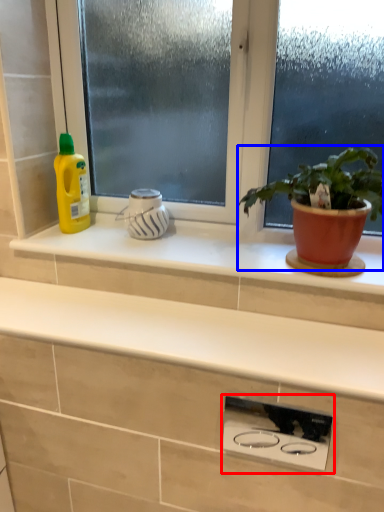
Question: Which object is further to the camera taking this photo, appliance (highlighted by a red box) or houseplant (highlighted by a blue box)?

Choices:
 (A) appliance
 (B) houseplant

Answer: (A)